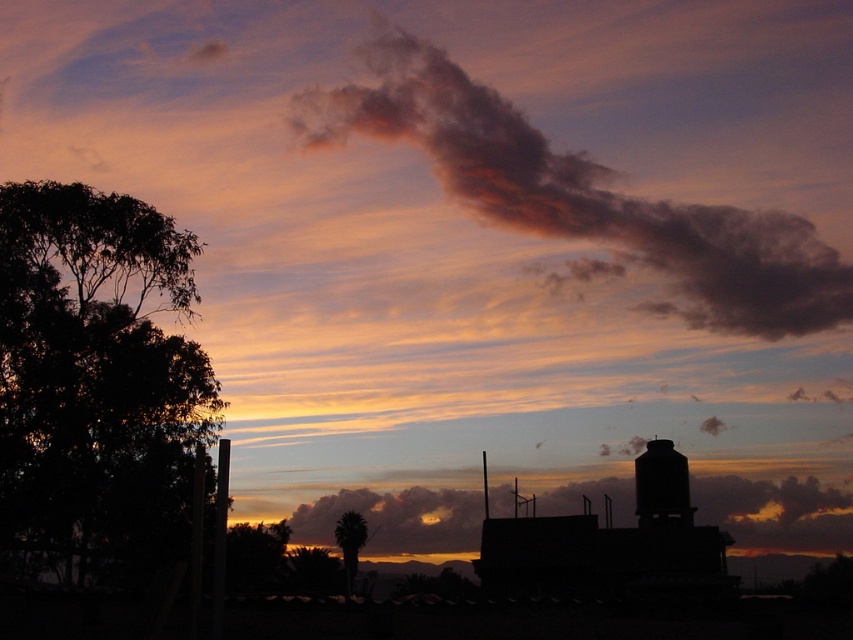
Question: Which point is farther to the camera?

Choices:
 (A) smoky gray cloud at upper center
 (B) dark green leafy tree at left
 (C) cloudy sky at center

Answer: (A)

Question: Which object is closer to the camera taking this photo?

Choices:
 (A) cloudy sky at center
 (B) green leafy tree at center
 (C) dark green leafy tree at left
 (D) smoky gray cloud at upper center

Answer: (C)

Question: Can you confirm if dark green leafy tree at left is wider than smoky gray cloud at upper center?

Choices:
 (A) no
 (B) yes

Answer: (A)

Question: Which of the following is the farthest from the observer?

Choices:
 (A) smoky gray cloud at upper center
 (B) dark green leafy tree at left
 (C) green leafy tree at center

Answer: (A)

Question: Where is dark green leafy tree at left located in relation to smoky gray cloud at upper center in the image?

Choices:
 (A) below
 (B) above

Answer: (A)

Question: Is dark green leafy tree at left below green leafy tree at center?

Choices:
 (A) no
 (B) yes

Answer: (A)